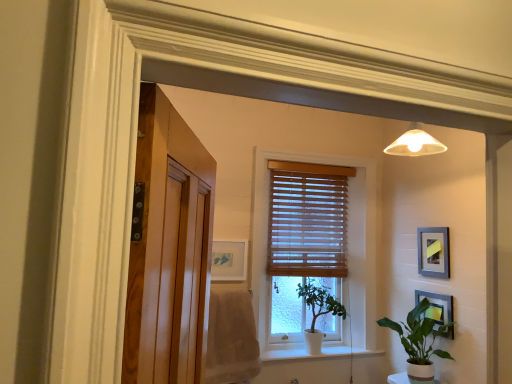
Question: Do you think beige cotton bath towel at left is within gray matte picture frame at upper right, which is the 1th picture frame in right-to-left order, or outside of it?

Choices:
 (A) inside
 (B) outside

Answer: (B)

Question: From the image's perspective, is beige cotton bath towel at left positioned above or below gray matte picture frame at upper right, which is the 1th picture frame in right-to-left order?

Choices:
 (A) above
 (B) below

Answer: (B)

Question: Estimate the real-world distances between objects in this image. Which object is closer to the green glossy houseplant at lower right, placed as the 1th houseplant when sorted from right to left?

Choices:
 (A) gray matte picture frame at upper right, which is the 1th picture frame in right-to-left order
 (B) beige cotton bath towel at left
 (C) wooden blinds at center
 (D) wooden blinds at center
 (E) green matte plant at center, positioned as the second houseplant in front-to-back order

Answer: (A)

Question: Based on their relative distances, which object is nearer to the wooden blinds at center?

Choices:
 (A) metallic silver picture frame at lower right, the second picture frame when ordered from right to left
 (B) beige cotton bath towel at left
 (C) wooden blinds at center
 (D) gray matte picture frame at upper right, marked as the third picture frame in a left-to-right arrangement
 (E) green glossy houseplant at lower right, which is the second houseplant from left to right

Answer: (C)